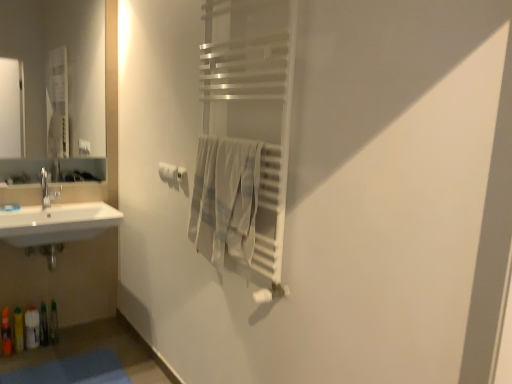
Question: Visually, is white matte toilet paper at center positioned to the left or to the right of translucent plastic bottle at lower left, placed as the 4th toiletry when sorted from right to left?

Choices:
 (A) right
 (B) left

Answer: (A)

Question: Is point (177, 173) closer or farther from the camera than point (8, 319)?

Choices:
 (A) farther
 (B) closer

Answer: (B)

Question: Considering the real-world distances, which object is farthest from the white matte toilet paper at center?

Choices:
 (A) satin silver towel rack at center
 (B) translucent plastic bottles at lower left, the second toiletry when ordered from right to left
 (C) translucent plastic bottles at lower left, the fourth toiletry viewed from the left
 (D) translucent plastic bottle at lower left, placed as the 4th toiletry when sorted from right to left
 (E) satin nickel towel bar at center

Answer: (D)

Question: Based on their relative distances, which object is nearer to the translucent plastic bottles at lower left, the 3th toiletry in the right-to-left sequence?

Choices:
 (A) light beige cotton towel at center
 (B) satin nickel towel bar at center
 (C) blue fabric bath mat at lower left
 (D) white matte toilet paper at center
 (E) matte silver mirror at upper left

Answer: (C)